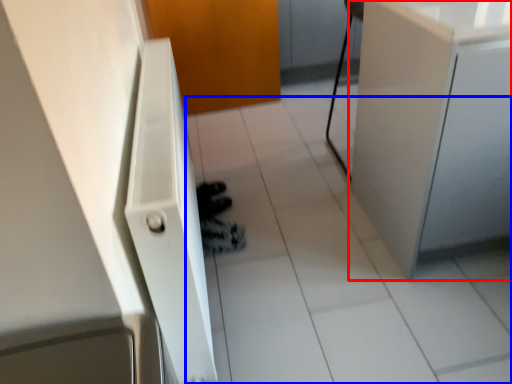
Question: Which point is further to the camera, cabinetry (highlighted by a red box) or tile (highlighted by a blue box)?

Choices:
 (A) cabinetry
 (B) tile

Answer: (B)